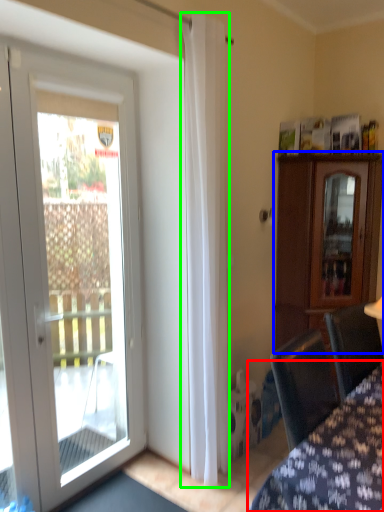
Question: Based on their relative distances, which object is farther from furniture (highlighted by a red box)? Choose from cabinetry (highlighted by a blue box) and curtain (highlighted by a green box).

Choices:
 (A) cabinetry
 (B) curtain

Answer: (A)